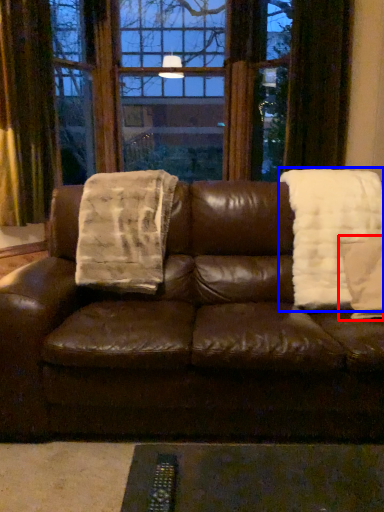
Question: Which point is closer to the camera, throw pillow (highlighted by a red box) or blanket (highlighted by a blue box)?

Choices:
 (A) throw pillow
 (B) blanket

Answer: (A)